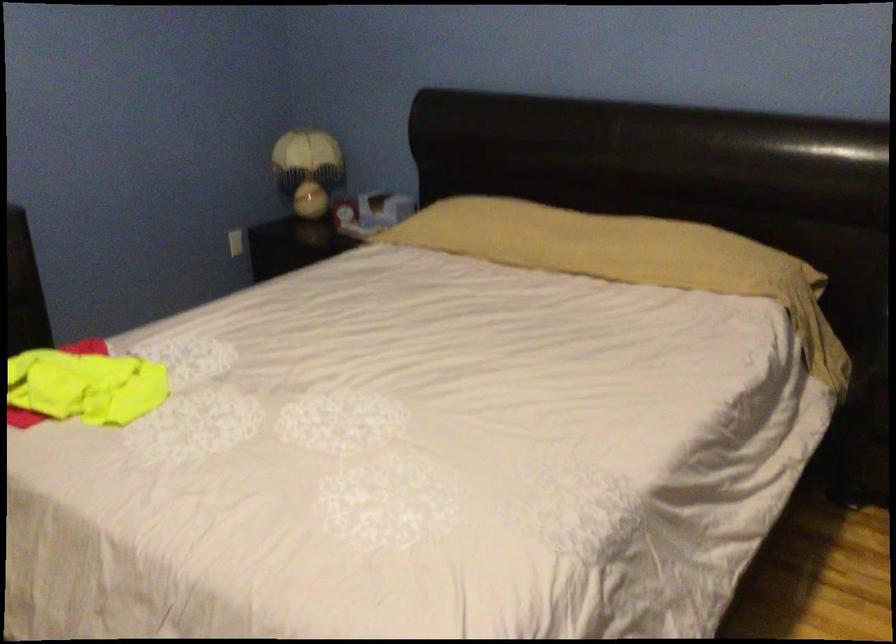
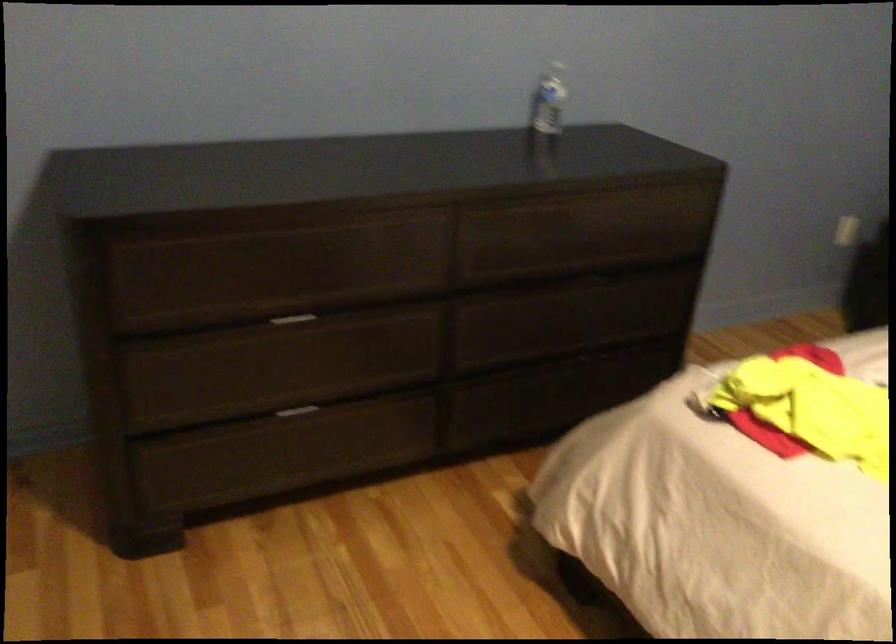
Question: The camera is either moving clockwise (left) or counter-clockwise (right) around the object. The first image is from the beginning of the video and the second image is from the end. Is the camera moving left or right when shooting the video?

Choices:
 (A) Left
 (B) Right

Answer: (B)